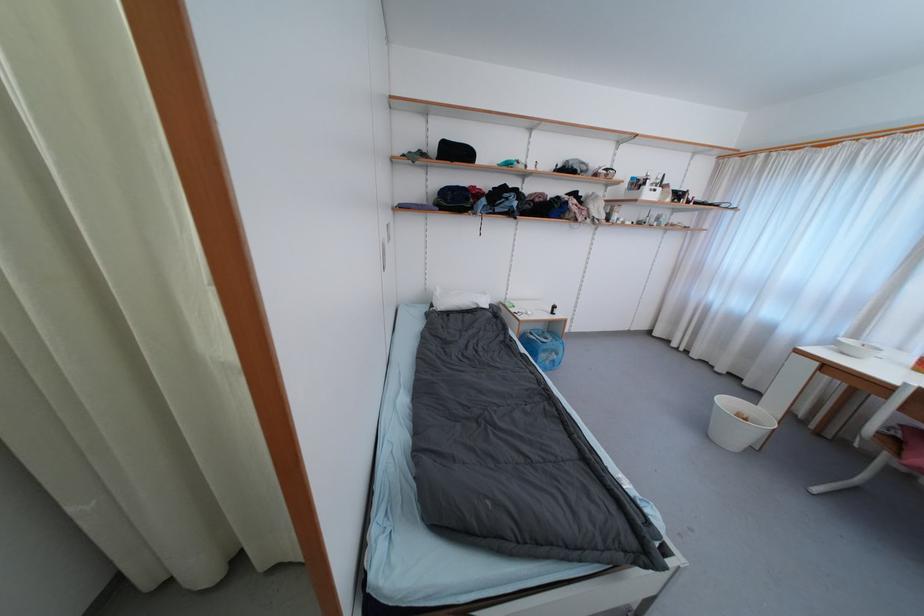
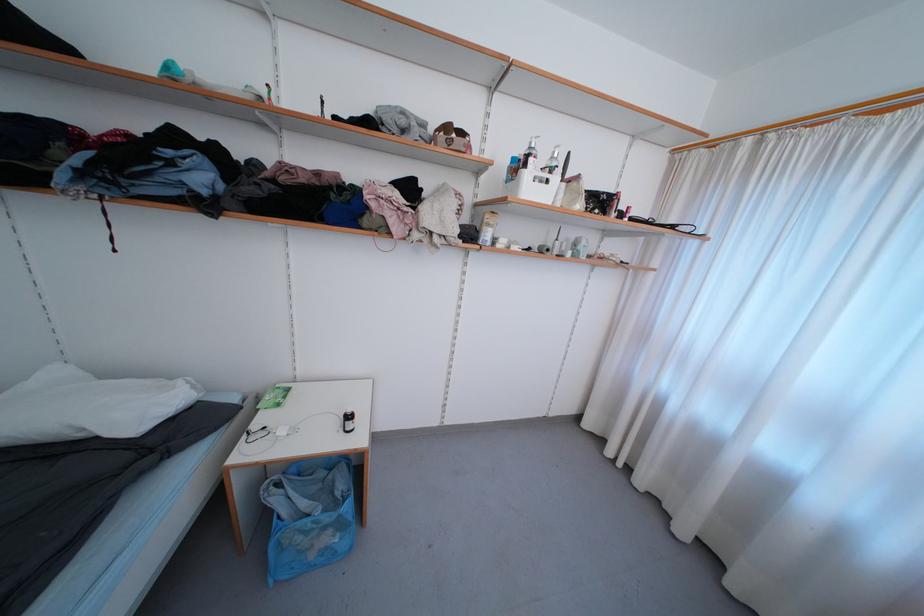
Question: I am providing you with two images of the same scene from different viewpoints. Which of the following objects are not visible in image2?

Choices:
 (A) blue mesh hamper
 (B) white plastic caddy
 (C) beige patterned purse
 (D) none of these

Answer: (D)